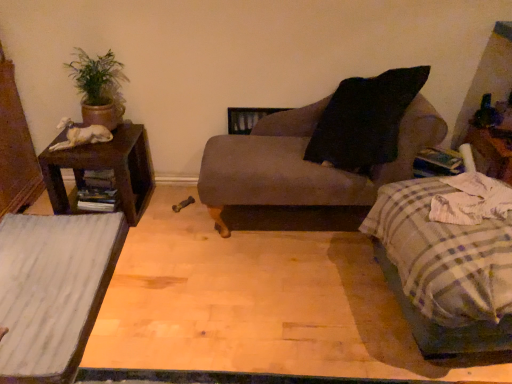
Find the location of a particular element. This screenshot has width=512, height=384. vacant space in front of green matte plant at upper left is located at coordinates (102, 149).